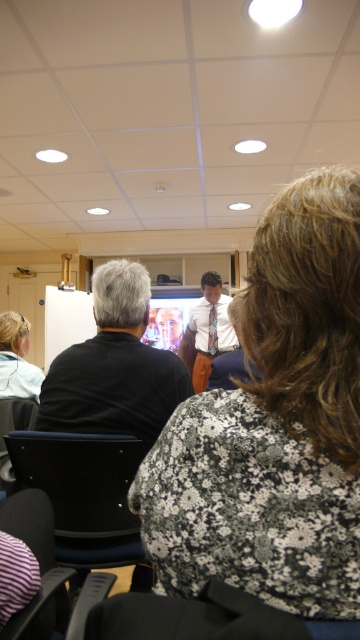
Is point (227, 342) in front of point (20, 316)?

No, (227, 342) is further to viewer.

Measure the distance between point (x=191, y=314) and camera.

The distance of point (x=191, y=314) from camera is 14.51 feet.

Between point (198, 353) and point (1, 392), which one is positioned in front?

Point (1, 392)

Locate an element on the screen. The width and height of the screenshot is (360, 640). white shirt with tie at center is located at coordinates (206, 330).

Is the position of striped fabric chair at lower left less distant than that of blonde hair at lower left?

Yes, it is in front of blonde hair at lower left.

Can you confirm if striped fabric chair at lower left is bigger than blonde hair at lower left?

No.

At what (x,y) coordinates should I click in order to perform the action: click on striped fabric chair at lower left. Please return your answer as a coordinate pair (x, y). Image resolution: width=360 pixels, height=640 pixels. Looking at the image, I should click on (30, 524).

Where is `striped fabric chair at lower left`? striped fabric chair at lower left is located at coordinates (30, 524).

Can you confirm if floral fabric shirt at center is smaller than striped fabric chair at lower left?

No.

Is floral fabric shirt at center below striped fabric chair at lower left?

Actually, floral fabric shirt at center is above striped fabric chair at lower left.

What are the coordinates of `floral fabric shirt at center` in the screenshot? It's located at (273, 426).

The width and height of the screenshot is (360, 640). Identify the location of floral fabric shirt at center. (273, 426).